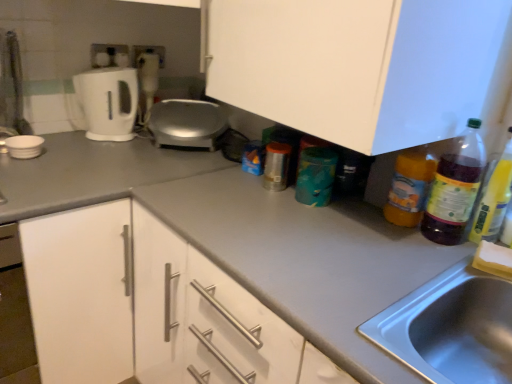
This screenshot has height=384, width=512. Identify the location of vacant space to the left of translucent plastic bottle at right. pos(372,232).